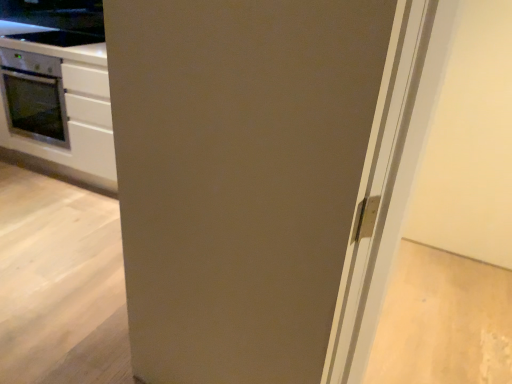
Identify the location of matte gray door at center. This screenshot has width=512, height=384. (258, 179).

Image resolution: width=512 pixels, height=384 pixels. What do you see at coordinates (57, 102) in the screenshot?
I see `white glossy cabinet at left` at bounding box center [57, 102].

Identify the location of matte gray door at center. This screenshot has height=384, width=512. (258, 179).

Can you tell me how much white glossy cabinet at left and smooth black countertop at upper left differ in facing direction?

0.00115 degrees separate the facing orientations of white glossy cabinet at left and smooth black countertop at upper left.

Considering the relative sizes of white glossy cabinet at left and smooth black countertop at upper left in the image provided, is white glossy cabinet at left wider than smooth black countertop at upper left?

Yes.

Consider the image. Could smooth black countertop at upper left be considered to be inside white glossy cabinet at left?

That's incorrect, smooth black countertop at upper left is not inside white glossy cabinet at left.

Consider the image. From the image's perspective, is white glossy cabinet at left positioned above or below smooth black countertop at upper left?

white glossy cabinet at left is situated lower than smooth black countertop at upper left in the image.

Is matte gray door at center oriented away from smooth black countertop at upper left?

That's not correct — matte gray door at center is not looking away from smooth black countertop at upper left.

From a real-world perspective, relative to smooth black countertop at upper left, is matte gray door at center vertically above or below?

Clearly, from a real-world perspective, matte gray door at center is below smooth black countertop at upper left.

Where is `counter top above the matte gray door at center (from the image's perspective)`? counter top above the matte gray door at center (from the image's perspective) is located at coordinates (54, 43).

Is matte gray door at center positioned behind smooth black countertop at upper left?

No.

Is smooth black countertop at upper left placed right next to matte gray door at center?

No, smooth black countertop at upper left is not next to matte gray door at center.

Choose the correct answer: Is smooth black countertop at upper left inside matte gray door at center or outside it?

The correct answer is: outside.

Considering the relative sizes of smooth black countertop at upper left and matte gray door at center in the image provided, is smooth black countertop at upper left bigger than matte gray door at center?

No, smooth black countertop at upper left is not bigger than matte gray door at center.

How different are the orientations of smooth black countertop at upper left and matte gray door at center in degrees?

The angular difference between smooth black countertop at upper left and matte gray door at center is 10.6 degrees.

Based on their sizes in the image, would you say matte gray door at center is bigger or smaller than white glossy cabinet at left?

matte gray door at center is smaller than white glossy cabinet at left.

Would you say matte gray door at center is inside or outside white glossy cabinet at left?

matte gray door at center lies outside white glossy cabinet at left.

Considering the relative positions of matte gray door at center and white glossy cabinet at left in the image provided, is matte gray door at center to the left or to the right of white glossy cabinet at left?

matte gray door at center is to the right of white glossy cabinet at left.

Is matte gray door at center taller than white glossy cabinet at left?

Yes.

Does white glossy cabinet at left have a lesser width compared to matte gray door at center?

No.

Locate an element on the screen. cabinetry located underneath the matte gray door at center (from a real-world perspective) is located at coordinates (57, 102).

Who is taller, white glossy cabinet at left or matte gray door at center?

matte gray door at center is taller.

Looking at this image, is white glossy cabinet at left directly adjacent to matte gray door at center?

No, white glossy cabinet at left is not with matte gray door at center.

Is smooth black countertop at upper left not close to white glossy cabinet at left?

Actually, smooth black countertop at upper left and white glossy cabinet at left are a little close together.

Considering the relative sizes of smooth black countertop at upper left and white glossy cabinet at left in the image provided, is smooth black countertop at upper left thinner than white glossy cabinet at left?

Correct, the width of smooth black countertop at upper left is less than that of white glossy cabinet at left.

Measure the distance from smooth black countertop at upper left to white glossy cabinet at left.

smooth black countertop at upper left and white glossy cabinet at left are 25.06 inches apart from each other.

Where is `cabinetry located on the left of smooth black countertop at upper left`? The height and width of the screenshot is (384, 512). cabinetry located on the left of smooth black countertop at upper left is located at coordinates (57, 102).

I want to click on counter top lying behind the white glossy cabinet at left, so [54, 43].

I want to click on counter top above the matte gray door at center (from a real-world perspective), so [54, 43].

Estimate the real-world distances between objects in this image. Which object is closer to matte gray door at center, smooth black countertop at upper left or white glossy cabinet at left?

The object closer to matte gray door at center is white glossy cabinet at left.

Which object lies nearer to the anchor point smooth black countertop at upper left, white glossy cabinet at left or matte gray door at center?

The object closer to smooth black countertop at upper left is white glossy cabinet at left.

Based on their spatial positions, is white glossy cabinet at left or smooth black countertop at upper left further from matte gray door at center?

smooth black countertop at upper left is further to matte gray door at center.

Estimate the real-world distances between objects in this image. Which object is further from white glossy cabinet at left, smooth black countertop at upper left or matte gray door at center?

matte gray door at center is further to white glossy cabinet at left.

Based on their spatial positions, is matte gray door at center or smooth black countertop at upper left further from white glossy cabinet at left?

matte gray door at center lies further to white glossy cabinet at left than the other object.

From the image, which object appears to be farther from smooth black countertop at upper left, matte gray door at center or white glossy cabinet at left?

matte gray door at center is positioned further to the anchor smooth black countertop at upper left.

Locate an element on the screen. The height and width of the screenshot is (384, 512). cabinetry located between matte gray door at center and smooth black countertop at upper left in the depth direction is located at coordinates point(57,102).